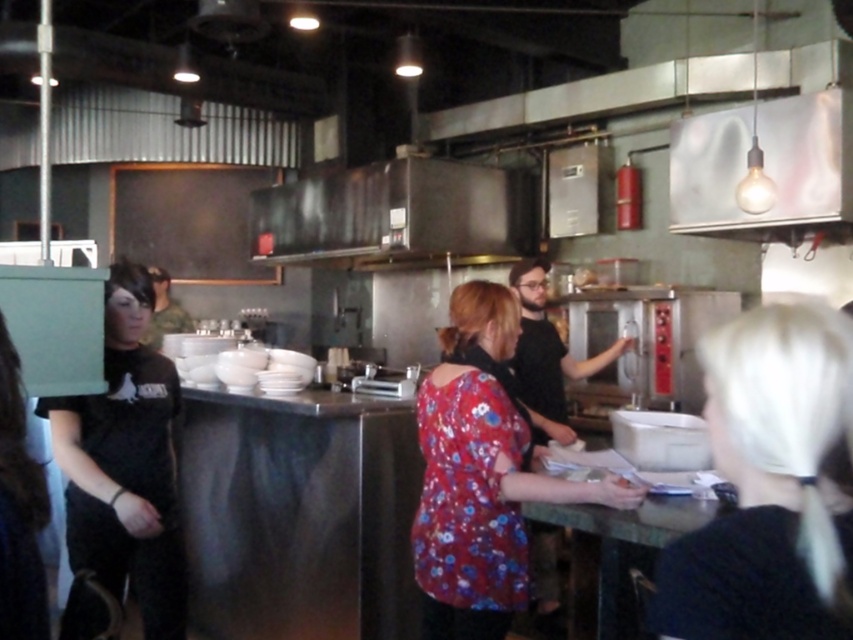
Is black matte shirt at left wider than matte black shirt at left?

Yes.

Describe the element at coordinates (125, 461) in the screenshot. This screenshot has width=853, height=640. I see `black matte shirt at left` at that location.

Find the location of a particular element. Image resolution: width=853 pixels, height=640 pixels. black matte shirt at left is located at coordinates (125, 461).

Does blonde hair at center have a smaller size compared to black matte shirt at left?

Correct, blonde hair at center occupies less space than black matte shirt at left.

Which is below, blonde hair at center or black matte shirt at left?

Positioned lower is black matte shirt at left.

Find the location of a particular element. This screenshot has height=640, width=853. blonde hair at center is located at coordinates (770, 484).

I want to click on blonde hair at center, so click(x=770, y=484).

Measure the distance between blonde hair at center and camera.

33.85 inches

You are a GUI agent. You are given a task and a screenshot of the screen. Output one action in this format:
    pyautogui.click(x=<x>, y=<y>)
    Task: Click on the blonde hair at center
    This screenshot has width=853, height=640.
    Given the screenshot: What is the action you would take?
    pyautogui.click(x=770, y=484)